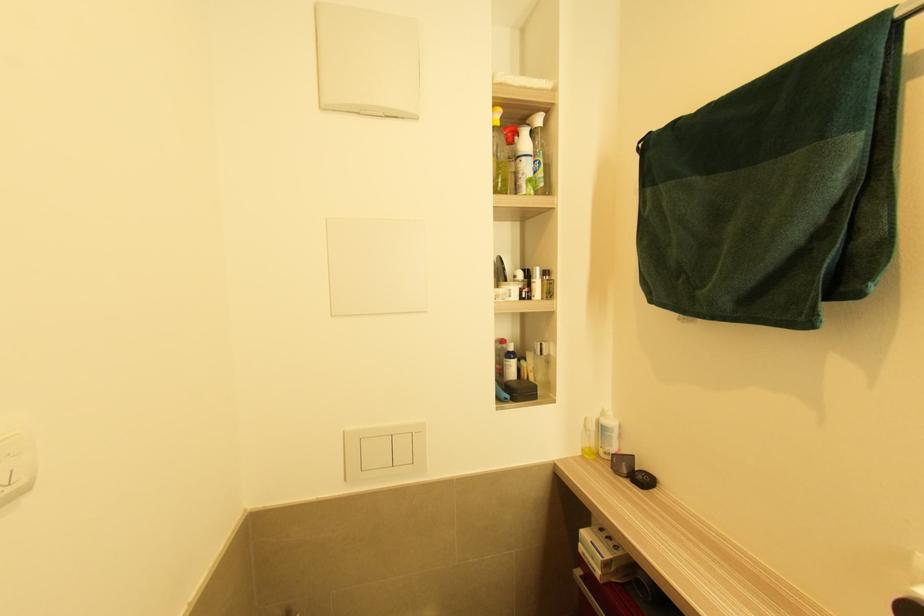
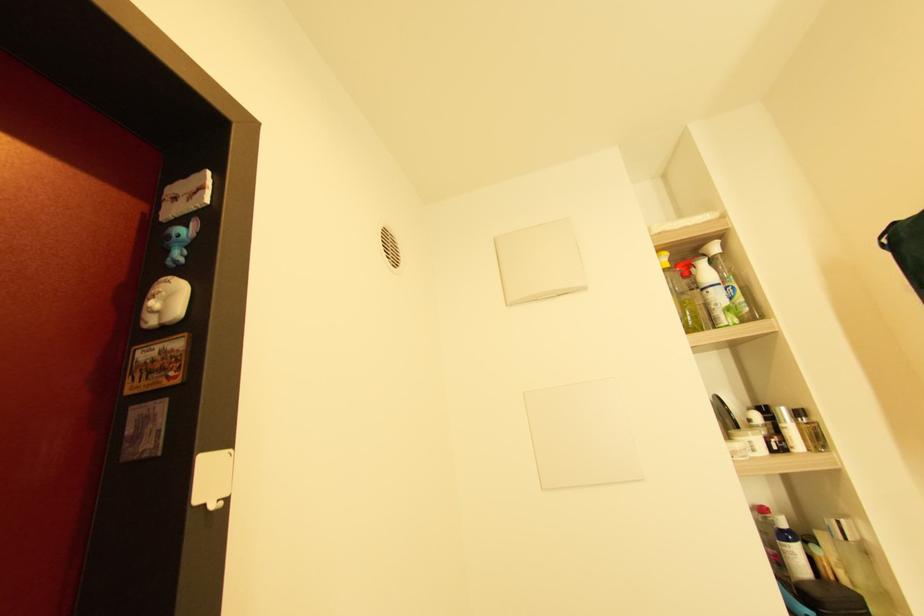
The images are taken continuously from a first-person perspective. In which direction is your viewpoint rotating?

The rotation direction of the camera is left-up.